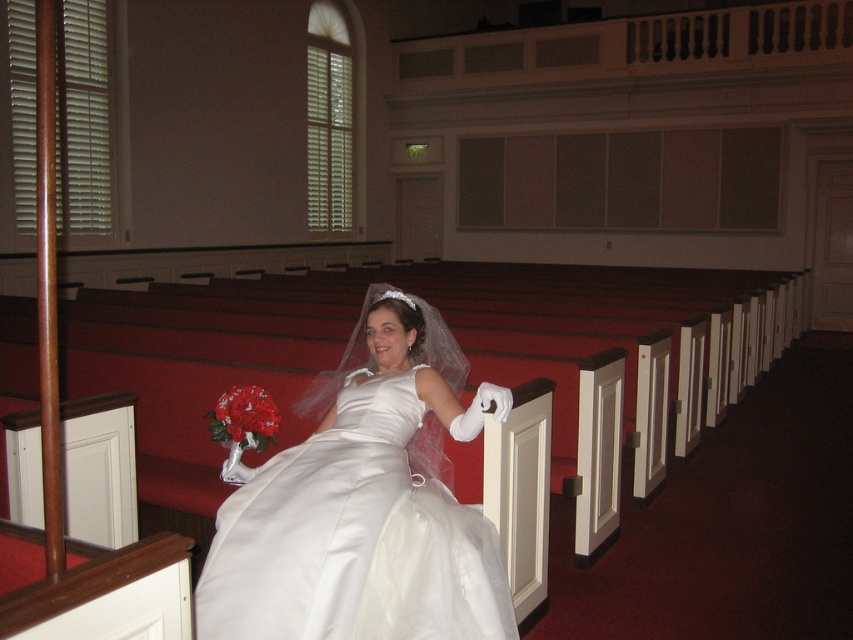
Question: Is the position of satin dress at center more distant than that of red satin bouquet at center?

Choices:
 (A) yes
 (B) no

Answer: (B)

Question: Does satin dress at center have a larger size compared to red satin bouquet at center?

Choices:
 (A) yes
 (B) no

Answer: (A)

Question: Does satin dress at center have a lesser width compared to red satin bouquet at center?

Choices:
 (A) yes
 (B) no

Answer: (B)